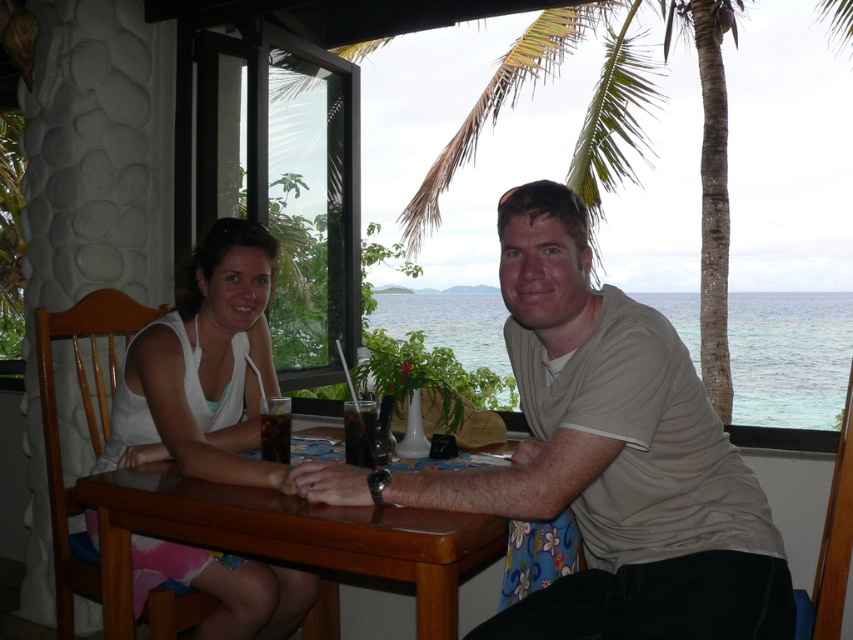
You are a photographer taking a picture of the scene. You notice the white fabric dress at center and the translucent glass drink at table center. Which object will appear bigger in the photo?

The white fabric dress at center will appear bigger in the photo since it has a larger size compared to the translucent glass drink at table center.